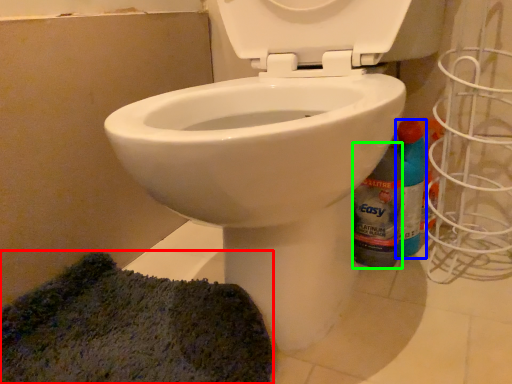
Question: Considering the real-world distances, which object is closest to doormat (highlighted by a red box)? cleaning product (highlighted by a blue box) or bottle (highlighted by a green box).

Choices:
 (A) cleaning product
 (B) bottle

Answer: (B)